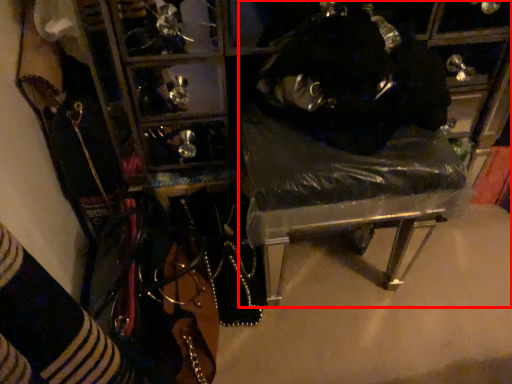
Question: Observing the image, what is the correct spatial positioning of furniture (annotated by the red box) in reference to person?

Choices:
 (A) right
 (B) left

Answer: (B)